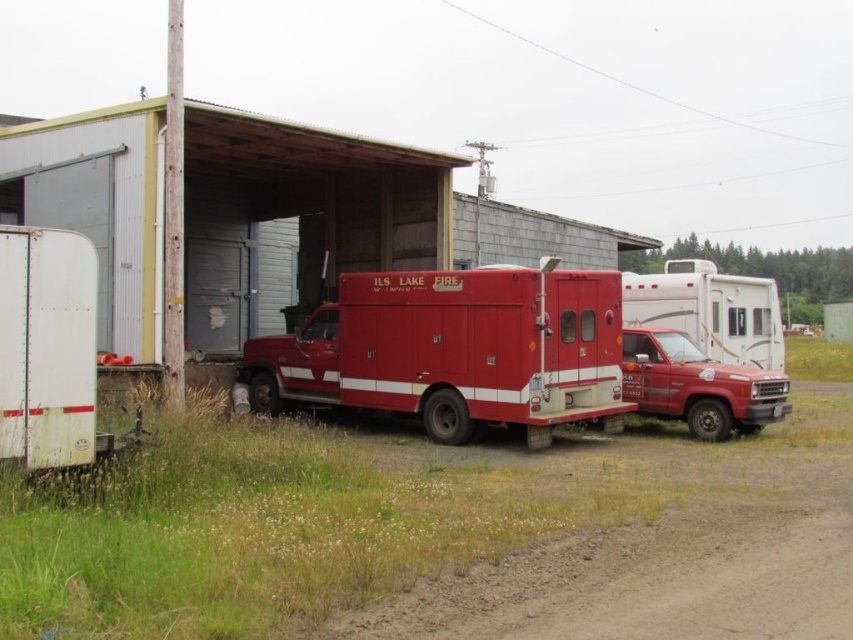
Question: Can you confirm if metallic red fire truck at center is positioned above shiny red fire truck at center?

Choices:
 (A) no
 (B) yes

Answer: (A)

Question: Which point is closer to the camera taking this photo?

Choices:
 (A) (695, 358)
 (B) (200, 572)

Answer: (B)

Question: Does shiny red fire truck at center lie behind matte red fire truck at center?

Choices:
 (A) no
 (B) yes

Answer: (B)

Question: Is shiny red fire truck at center closer to camera compared to matte red fire truck at center?

Choices:
 (A) yes
 (B) no

Answer: (B)

Question: Which object is the farthest from the metallic red fire truck at center?

Choices:
 (A) shiny red fire truck at center
 (B) matte red fire truck at center

Answer: (A)

Question: Among these points, which one is nearest to the camera?

Choices:
 (A) (171, 524)
 (B) (496, 392)

Answer: (A)